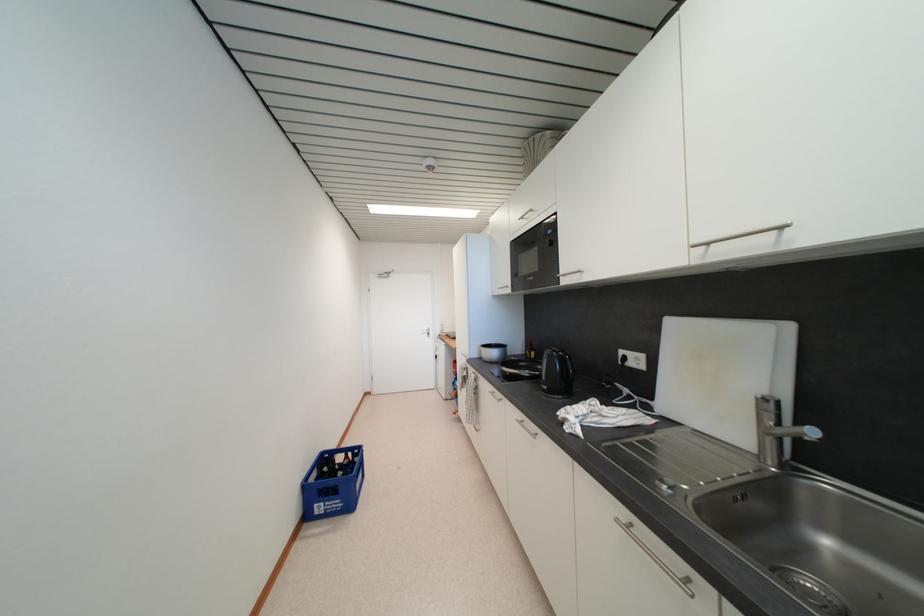
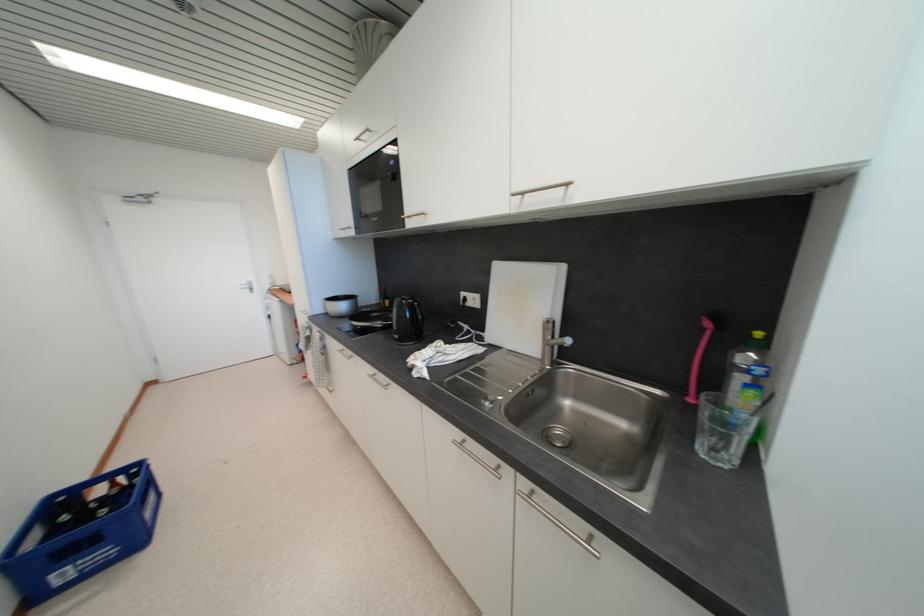
In the second image, find the point that corresponds to point (501, 373) in the first image.

(351, 328)